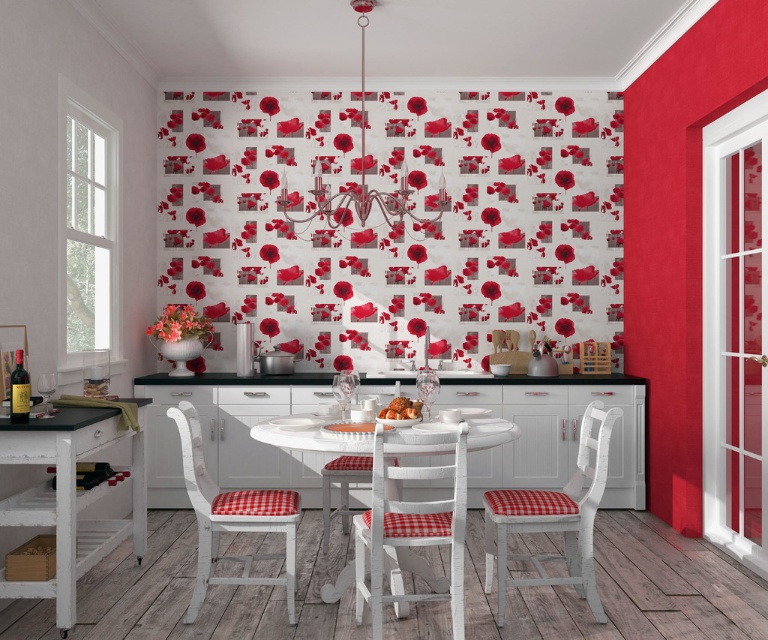
Question: Which of the following is the farthest from the observer?

Choices:
 (A) (300, 449)
 (B) (272, 529)
 (C) (363, 468)
 (D) (584, 538)

Answer: (C)

Question: Which point is closer to the camera?

Choices:
 (A) (555, 529)
 (B) (187, 458)

Answer: (B)

Question: Considering the relative positions of white wood table at left and white painted wood chair with red checkered cushion at center in the image provided, where is white wood table at left located with respect to white painted wood chair with red checkered cushion at center?

Choices:
 (A) left
 (B) right

Answer: (A)

Question: Can you confirm if white wood chair with red checkered cushion at center is smaller than white painted wood chair with red checkered cushion at lower left?

Choices:
 (A) yes
 (B) no

Answer: (B)

Question: From the image, what is the correct spatial relationship of white painted wood chair with red checkered cushion at center in relation to white wooden table at center?

Choices:
 (A) left
 (B) right

Answer: (B)

Question: Among these objects, which one is farthest from the camera?

Choices:
 (A) white wood table at left
 (B) white painted wood chair with red checkered cushion at lower left

Answer: (B)